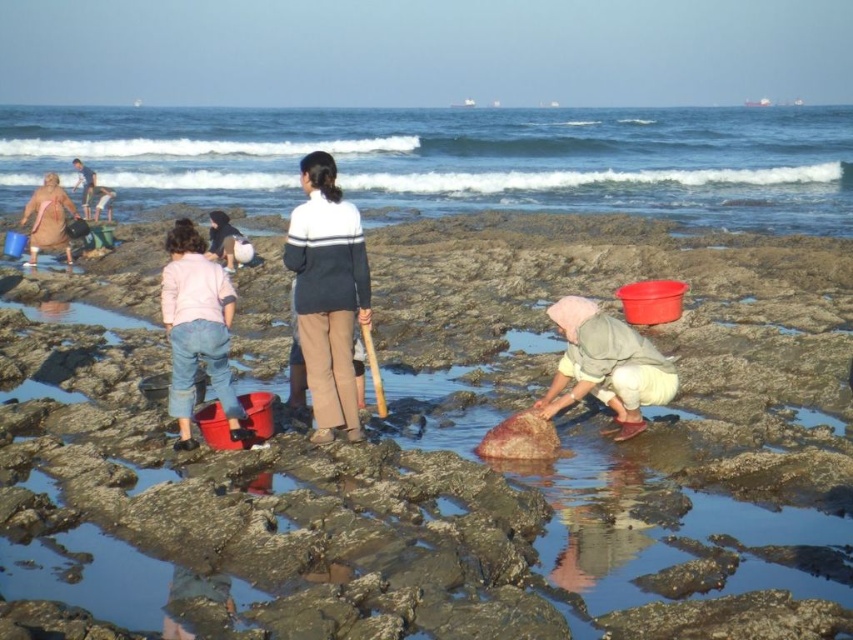
Looking at this image, you are a photographer standing on the beach and want to capture a photo of the clear blue water at upper center and the matte pink towel at left. Based on their positions, which object would appear larger in the photo?

The clear blue water at upper center appears larger in the photo because it is much taller than the matte pink towel at left.

You are standing at the edge of the rocky shoreline and want to reach the clear blue water at upper center. If your maximum walking distance is 25 meters, can you reach it without getting your shoes wet?

The clear blue water at upper center is 26.93 meters away from the viewer. Since your maximum walking distance is 25 meters, you cannot reach it without getting your shoes wet.